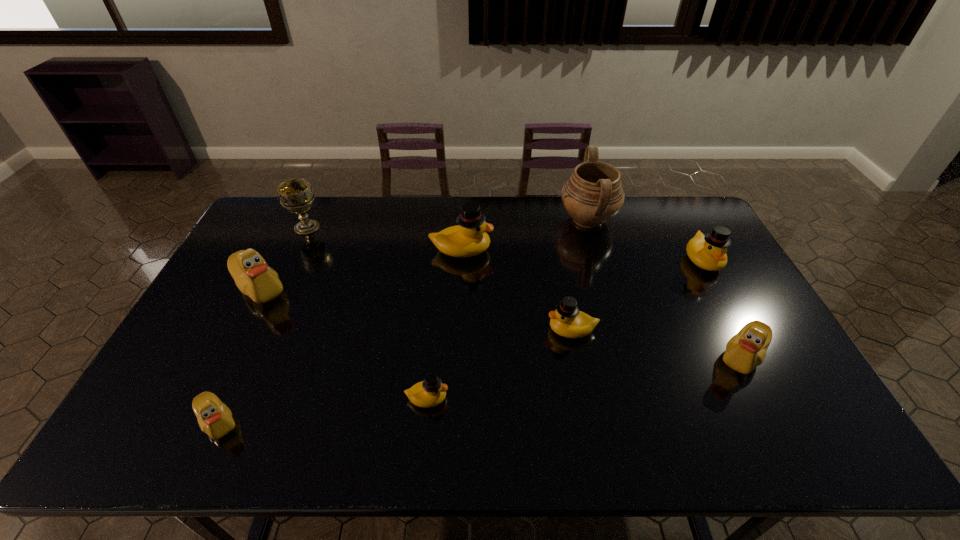
The height and width of the screenshot is (540, 960). I want to click on urn, so click(x=593, y=194).

At what (x,y) coordinates should I click in order to perform the action: click on the biggest yellow duck. Please return your answer as a coordinate pair (x, y). Looking at the image, I should click on (469, 238).

Identify the location of white chalice. (296, 195).

Locate an element on the screen. The height and width of the screenshot is (540, 960). the biggest beige duck is located at coordinates (253, 277).

I want to click on the third smallest yellow duck, so click(708, 252).

This screenshot has width=960, height=540. Find the location of `the second nearest beige duck`. the second nearest beige duck is located at coordinates (746, 350).

Where is `the second biggest beige duck`? the second biggest beige duck is located at coordinates (746, 350).

Locate an element on the screen. The image size is (960, 540). the second yellow duck from right to left is located at coordinates (567, 321).

Where is `the second smallest yellow duck`? This screenshot has height=540, width=960. the second smallest yellow duck is located at coordinates tap(567, 321).

Image resolution: width=960 pixels, height=540 pixels. Find the location of `the nearest beige duck`. the nearest beige duck is located at coordinates (215, 419).